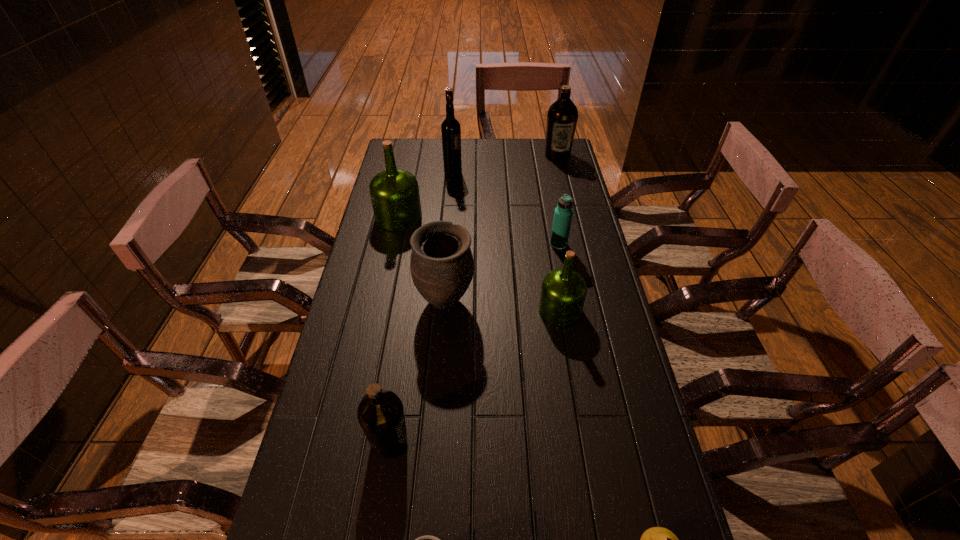
Locate an element on the screen. thermos bottle is located at coordinates (563, 213).

Where is `aqua thermos bottle`? aqua thermos bottle is located at coordinates (563, 213).

At what (x,y) coordinates should I click in order to perform the action: click on vacant space located on the front and back of the wine bottle. Please return your answer as a coordinate pair (x, y). This screenshot has height=540, width=960. Looking at the image, I should click on (498, 173).

Where is `vacant position located 0.170m on the label of the right brown olive oil`? vacant position located 0.170m on the label of the right brown olive oil is located at coordinates (564, 185).

Locate an element on the screen. Image resolution: width=960 pixels, height=540 pixels. vacant space located on the front of the third nearest olive oil is located at coordinates (380, 303).

Locate an element on the screen. The width and height of the screenshot is (960, 540). vacant space located on the back of the urn is located at coordinates (448, 255).

In order to click on vacant space situated on the left of the right green olive oil in this screenshot , I will do `click(494, 310)`.

Image resolution: width=960 pixels, height=540 pixels. Identify the location of vacant space situated 0.390m on the label of the nearest olive oil. (578, 441).

Locate an element on the screen. The height and width of the screenshot is (540, 960). blank area located 0.100m on the front of the fourth farthest object is located at coordinates (564, 271).

You are a GUI agent. You are given a task and a screenshot of the screen. Output one action in this format:
    pyautogui.click(x=<x>, y=<y>)
    Task: Click on the object that is at the far edge
    The image size is (960, 540).
    Given the screenshot: What is the action you would take?
    pyautogui.click(x=562, y=116)